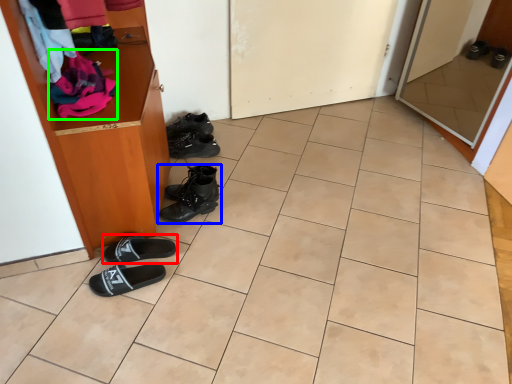
Question: Which object is the closest to the footwear (highlighted by a red box)? Choose among these: footwear (highlighted by a blue box) or clothing (highlighted by a green box).

Choices:
 (A) footwear
 (B) clothing

Answer: (A)